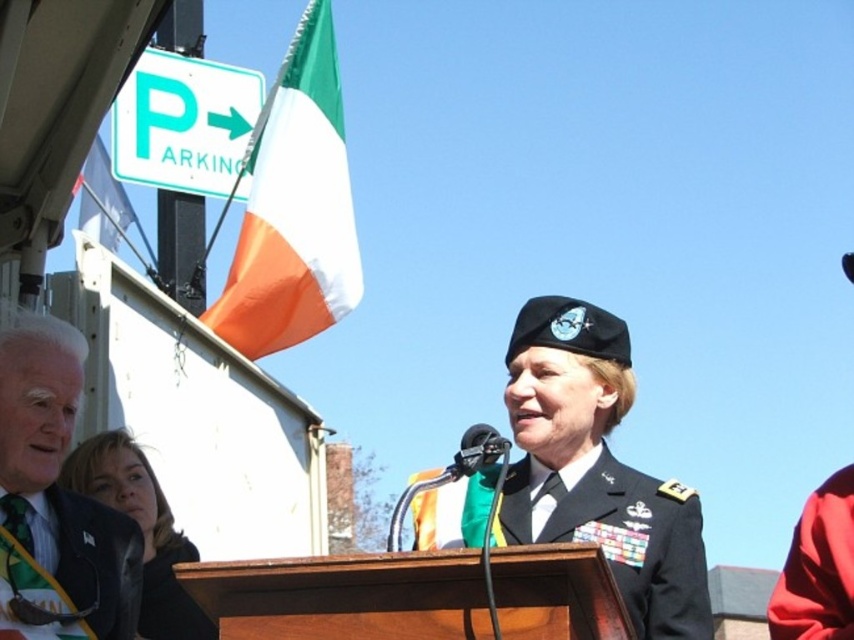
You are an event organizer setting up a stage for a military ceremony. You have two uniforms displayed on mannequins at the center of the stage. The black military uniform at center and the black matte uniform at center. According to the scene, which uniform is placed in front of the other?

The black military uniform at center is positioned over the black matte uniform at center, meaning it is placed in front of the other.